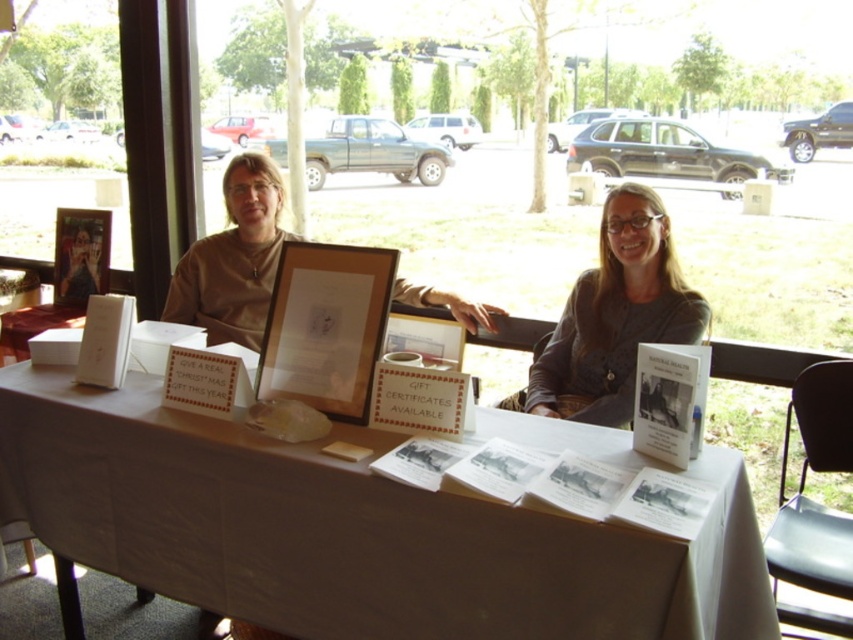
You are organizing a small fair booth and need to arrange items so that the wider object is placed on the left side for better visibility. Given the wooden frame at center and the matte brown shirt at center, which object should be placed on the left?

The matte brown shirt at center is wider than the wooden frame at center, so it should be placed on the left side for better visibility.

You are a visitor at this event and want to know which item is shorter between the wooden frame at center and the matte brown shirt at center. Can you tell me?

The wooden frame at center has a lesser height compared to matte brown shirt at center, so the wooden frame at center is shorter.